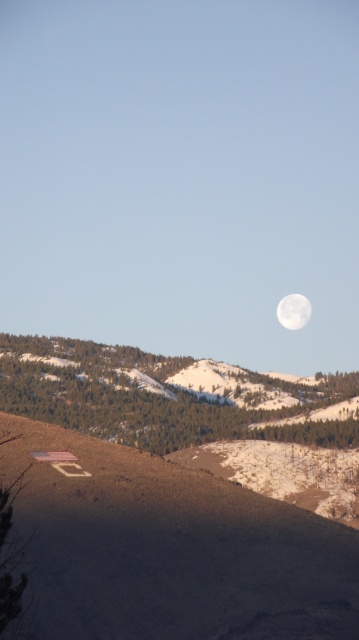
Is brown dirt at lower left taller than white glossy moon at upper center?

No.

Between brown dirt at lower left and white glossy moon at upper center, which one appears on the right side from the viewer's perspective?

Positioned to the right is white glossy moon at upper center.

Which is behind, point (38, 582) or point (302, 300)?

The point (302, 300) is more distant.

You are a GUI agent. You are given a task and a screenshot of the screen. Output one action in this format:
    pyautogui.click(x=<x>, y=<y>)
    Task: Click on the brown dirt at lower left
    The height and width of the screenshot is (640, 359).
    Given the screenshot: What is the action you would take?
    pyautogui.click(x=165, y=548)